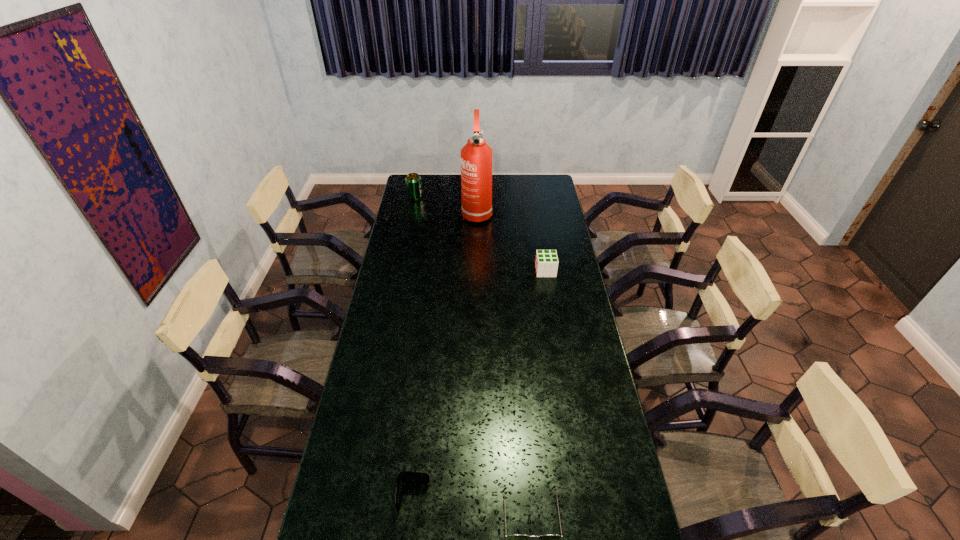
This screenshot has width=960, height=540. I want to click on the third object from left to right, so click(x=476, y=156).

The image size is (960, 540). I want to click on the tallest object, so click(x=476, y=156).

Identify the location of the second tallest object. The height and width of the screenshot is (540, 960). (412, 180).

The width and height of the screenshot is (960, 540). Identify the location of the leftmost object. pos(412,180).

Locate an element on the screen. the third tallest object is located at coordinates (546, 263).

The image size is (960, 540). Identify the location of cube. (546, 263).

You are a GUI agent. You are given a task and a screenshot of the screen. Output one action in this format:
    pyautogui.click(x=<x>, y=<y>)
    Task: Click on the second object from left to right
    This screenshot has height=540, width=960.
    Given the screenshot: What is the action you would take?
    pyautogui.click(x=403, y=477)

Where is `wallet`? Image resolution: width=960 pixels, height=540 pixels. wallet is located at coordinates (x=403, y=477).

Where is `vacant space located at the nozzle of the tallest object`? The width and height of the screenshot is (960, 540). vacant space located at the nozzle of the tallest object is located at coordinates (476, 235).

This screenshot has height=540, width=960. I want to click on vacant space situated on the right of the second tallest object, so click(432, 197).